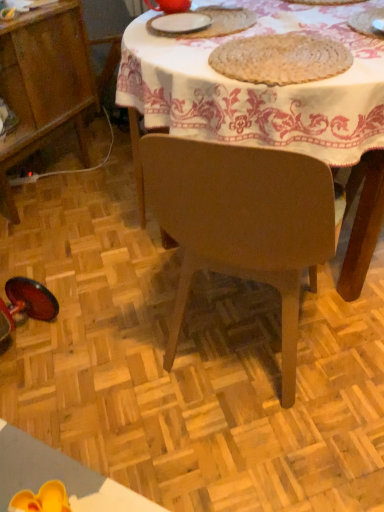
At what (x,y) coordinates should I click in order to perform the action: click on vacant space behind matte red teapot at upper center, the 3th tableware in the right-to-left sequence. Please return your answer as a coordinate pair (x, y). Looking at the image, I should click on (187, 6).